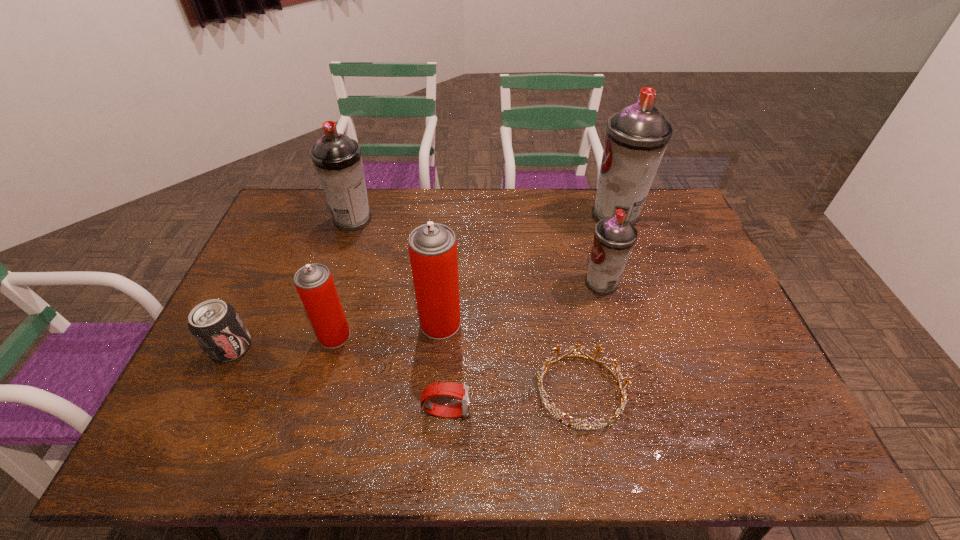
The image size is (960, 540). I want to click on the tallest object, so click(x=636, y=138).

This screenshot has height=540, width=960. What are the coordinates of `the biggest gray aerosol can` in the screenshot? It's located at (636, 138).

Where is `the second smallest gray aerosol can`? the second smallest gray aerosol can is located at coordinates (337, 158).

This screenshot has width=960, height=540. In order to click on the bigger red aerosol can in this screenshot , I will do `click(432, 247)`.

Locate an element on the screen. the third aerosol can from left to right is located at coordinates 432,247.

Where is `the left red aerosol can`? The image size is (960, 540). the left red aerosol can is located at coordinates (314, 283).

This screenshot has height=540, width=960. What are the coordinates of `the third farthest aerosol can` in the screenshot? It's located at (614, 238).

This screenshot has width=960, height=540. I want to click on the smallest gray aerosol can, so click(x=614, y=238).

The height and width of the screenshot is (540, 960). What are the coordinates of `the sixth tallest object` in the screenshot? It's located at (216, 326).

Locate an element on the screen. The image size is (960, 540). the leftmost object is located at coordinates (216, 326).